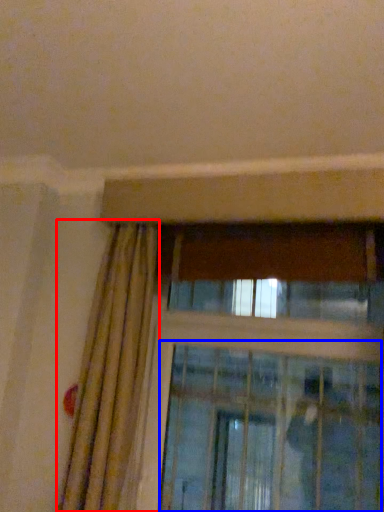
Question: Which object appears closest to the camera in this image, curtain (highlighted by a red box) or screen door (highlighted by a blue box)?

Choices:
 (A) curtain
 (B) screen door

Answer: (A)